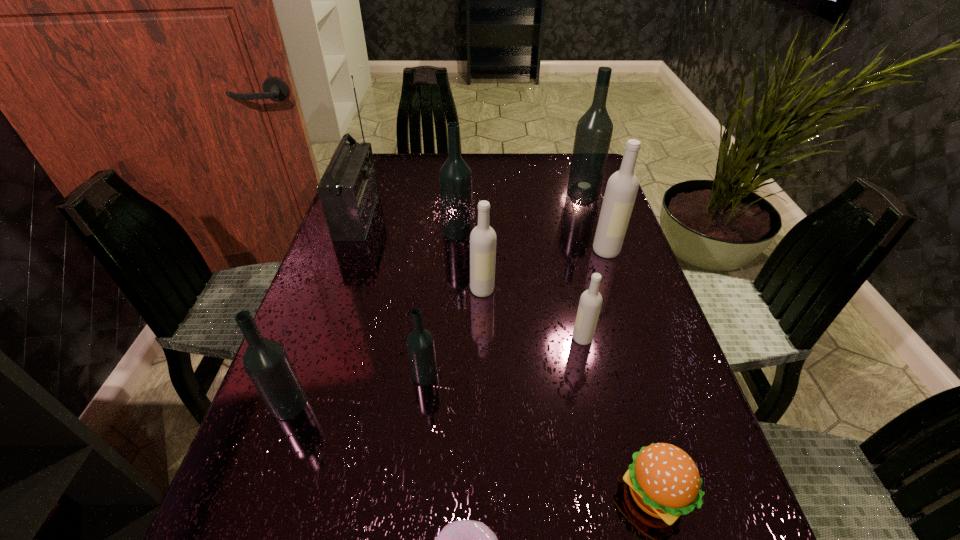
Image resolution: width=960 pixels, height=540 pixels. What are the coordinates of `free point located 0.340m on the front of the second farthest white vodka` in the screenshot? It's located at (484, 441).

Image resolution: width=960 pixels, height=540 pixels. What are the coordinates of `vacant space located 0.180m on the right of the second smallest black vodka` in the screenshot? It's located at (405, 404).

Locate an element on the screen. This screenshot has width=960, height=540. vacant point located on the left of the second white vodka from right to left is located at coordinates (433, 339).

At what (x,y) coordinates should I click in order to perform the action: click on free space located 0.390m on the right of the smallest black vodka. Please return your answer as a coordinate pair (x, y). Looking at the image, I should click on 638,375.

Find the location of a particular element. The image size is (960, 540). blank area located on the back of the hamburger is located at coordinates (634, 420).

Locate an element on the screen. object present at the far edge is located at coordinates click(594, 129).

Where is `radio receiver located in the left edge section of the desktop`? This screenshot has width=960, height=540. radio receiver located in the left edge section of the desktop is located at coordinates (348, 190).

This screenshot has height=540, width=960. In order to click on vodka present at the left edge in this screenshot , I will do `click(266, 362)`.

You are a GUI agent. You are given a task and a screenshot of the screen. Output one action in this format:
    pyautogui.click(x=<x>, y=<y>)
    Task: Click on the hamburger located at the right edge
    The height and width of the screenshot is (540, 960).
    Given the screenshot: What is the action you would take?
    pyautogui.click(x=664, y=481)

The image size is (960, 540). Identify the location of object present at the far right corner. (594, 129).